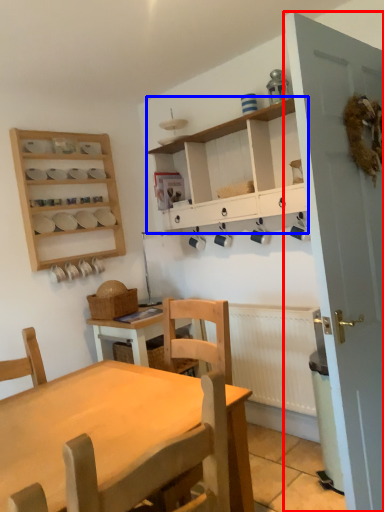
Question: Among these objects, which one is nearest to the camera, door (highlighted by a red box) or cabinetry (highlighted by a blue box)?

Choices:
 (A) door
 (B) cabinetry

Answer: (A)